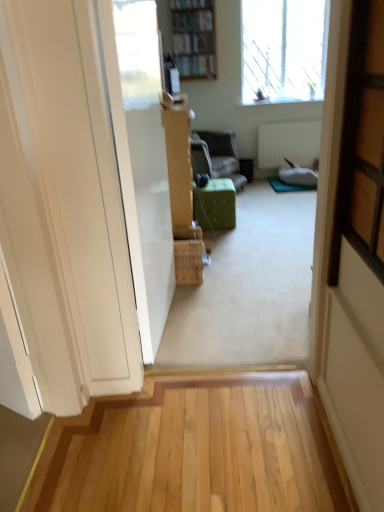
Question: Is green fabric ottoman at center, which is the second furniture from front to back, outside of wooden bookshelf at upper center?

Choices:
 (A) yes
 (B) no

Answer: (A)

Question: From a real-world perspective, is green fabric ottoman at center, which is the 1th furniture from top to bottom, positioned under wooden bookshelf at upper center based on gravity?

Choices:
 (A) no
 (B) yes

Answer: (B)

Question: Is green fabric ottoman at center, acting as the second furniture starting from the bottom, positioned before wooden bookshelf at upper center?

Choices:
 (A) yes
 (B) no

Answer: (A)

Question: Is there a large distance between green fabric ottoman at center, which is the second furniture from front to back, and wooden bookshelf at upper center?

Choices:
 (A) no
 (B) yes

Answer: (A)

Question: Does green fabric ottoman at center, arranged as the 1th furniture when viewed from the back, contain wooden bookshelf at upper center?

Choices:
 (A) yes
 (B) no

Answer: (B)

Question: Is green fabric ottoman at center, which is the 1th furniture from top to bottom, facing away from wooden bookshelf at upper center?

Choices:
 (A) no
 (B) yes

Answer: (A)

Question: Are green fabric ottoman at center, acting as the second furniture starting from the bottom, and transparent glass window at upper right located far from each other?

Choices:
 (A) no
 (B) yes

Answer: (B)

Question: Does green fabric ottoman at center, acting as the second furniture starting from the bottom, have a smaller size compared to transparent glass window at upper right?

Choices:
 (A) yes
 (B) no

Answer: (A)

Question: Is green fabric ottoman at center, which is the second furniture from front to back, turned away from transparent glass window at upper right?

Choices:
 (A) yes
 (B) no

Answer: (B)

Question: From the image's perspective, does green fabric ottoman at center, acting as the second furniture starting from the bottom, appear lower than transparent glass window at upper right?

Choices:
 (A) no
 (B) yes

Answer: (B)

Question: Could you tell me if green fabric ottoman at center, arranged as the 1th furniture when viewed from the back, is facing transparent glass window at upper right?

Choices:
 (A) no
 (B) yes

Answer: (A)

Question: From the image's perspective, is green fabric ottoman at center, which is the 1th furniture from top to bottom, on transparent glass window at upper right?

Choices:
 (A) yes
 (B) no

Answer: (B)

Question: Considering the relative positions of transparent glass window at upper right and green fabric ottoman at center, the first furniture in the front-to-back sequence, in the image provided, is transparent glass window at upper right to the right of green fabric ottoman at center, the first furniture in the front-to-back sequence, from the viewer's perspective?

Choices:
 (A) yes
 (B) no

Answer: (A)